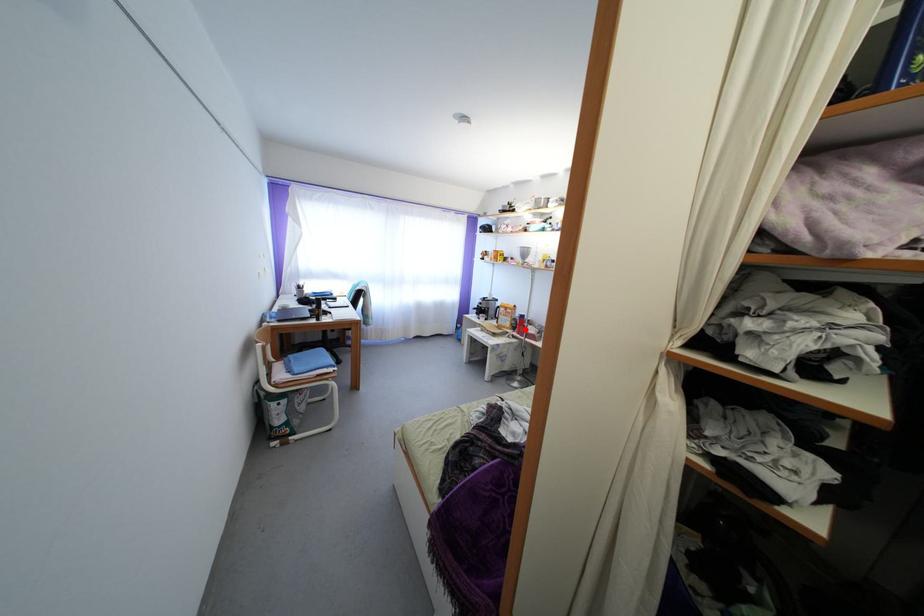
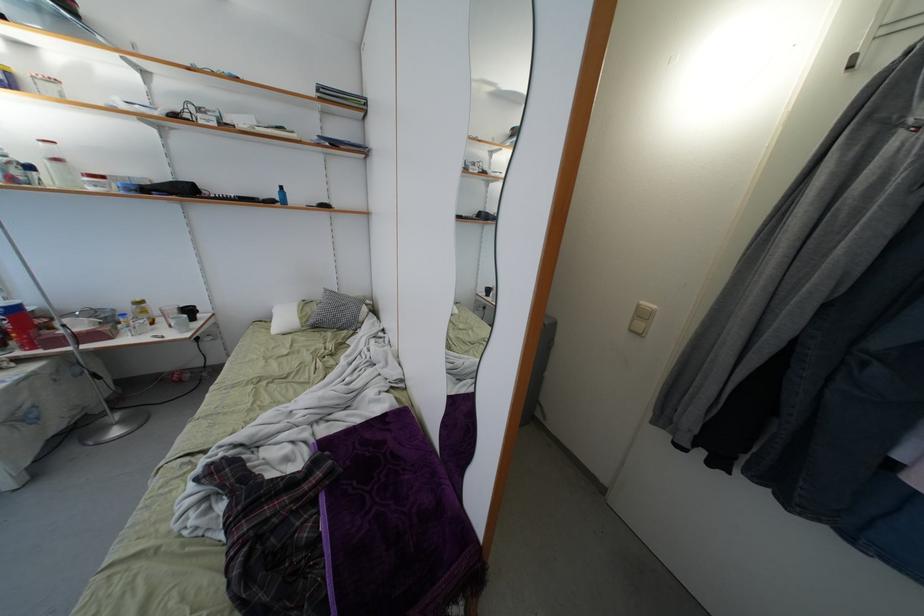
Question: I am providing you with two images of the same scene from different viewpoints. Given a red point in image1, look at the same physical point in image2. Is it:

Choices:
 (A) Closer to the viewpoint
 (B) Farther from the viewpoint

Answer: (B)